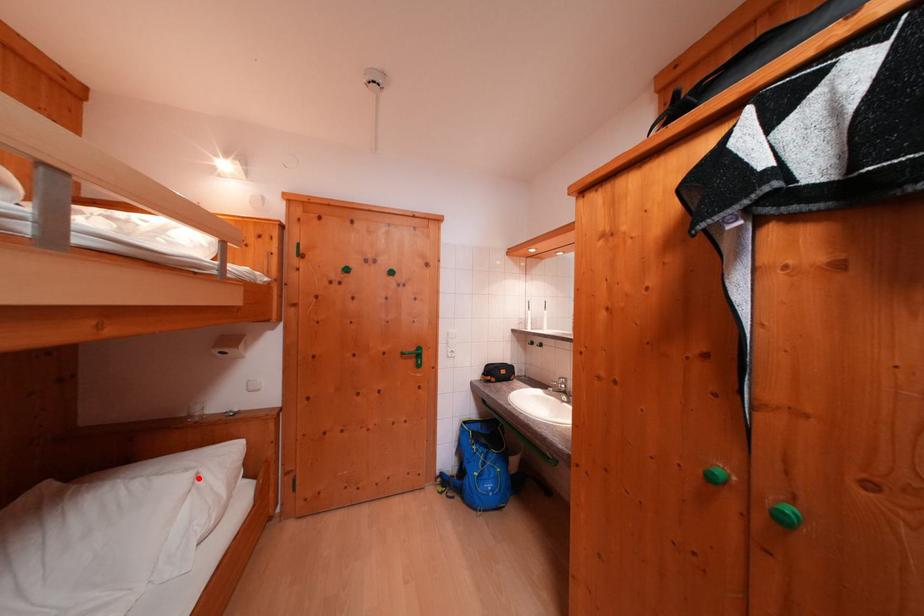
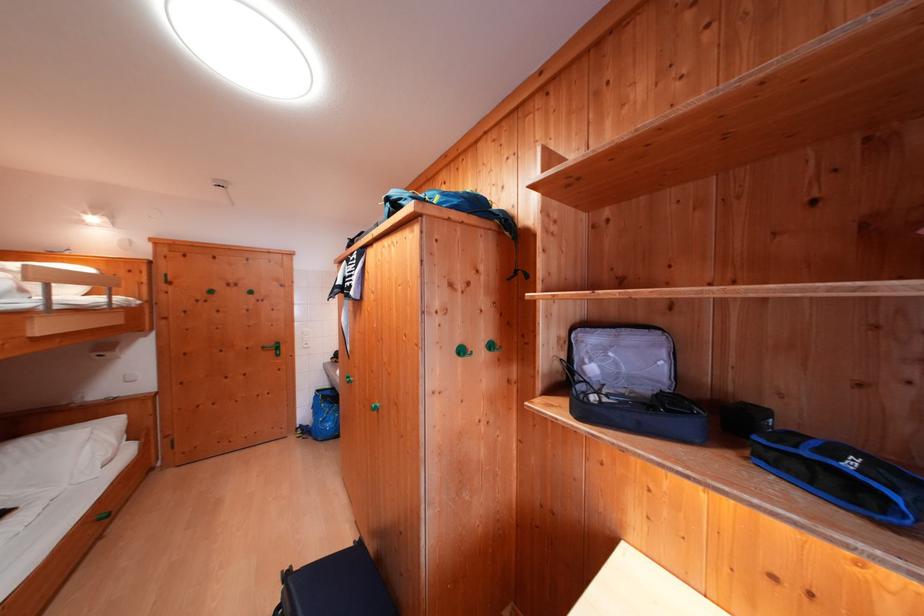
The point at the highlighted location is marked in the first image. Where is the corresponding point in the second image?

(96, 434)